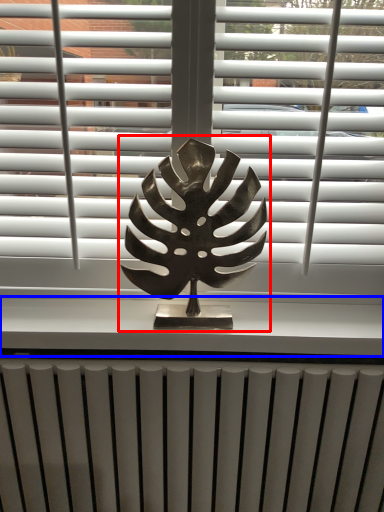
Question: Which object is further to the camera taking this photo, bronze statue (highlighted by a red box) or window sill (highlighted by a blue box)?

Choices:
 (A) bronze statue
 (B) window sill

Answer: (B)